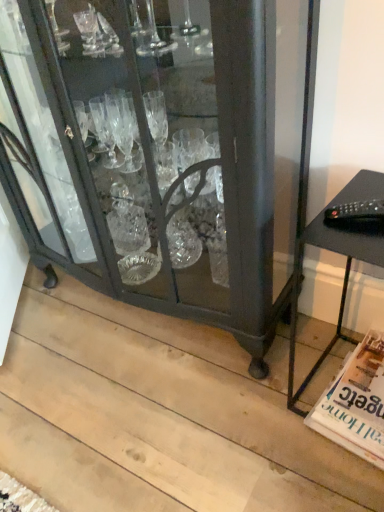
Where is `vacant space positioned to the left of white glossy magazine at lower right`? The width and height of the screenshot is (384, 512). vacant space positioned to the left of white glossy magazine at lower right is located at coordinates (273, 415).